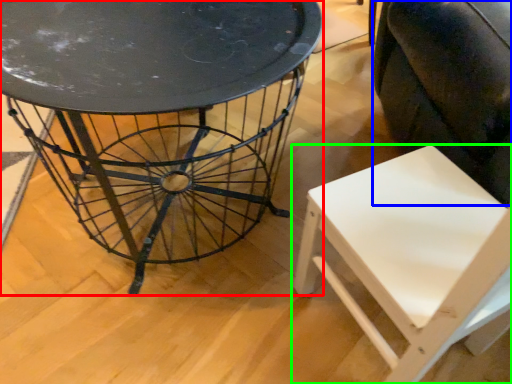
Question: Considering the real-world distances, which object is farthest from table (highlighted by a red box)? swivel chair (highlighted by a blue box) or chair (highlighted by a green box)?

Choices:
 (A) swivel chair
 (B) chair

Answer: (A)